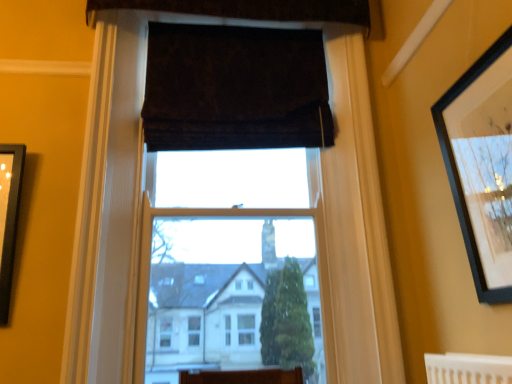
Question: Is the surface of black matte picture frame at upper right in direct contact with dark velvet curtain at upper center, the first curtain in the bottom-to-top sequence?

Choices:
 (A) no
 (B) yes

Answer: (A)

Question: Is black matte picture frame at upper right at the right side of dark velvet curtain at upper center, the first curtain in the bottom-to-top sequence?

Choices:
 (A) no
 (B) yes

Answer: (B)

Question: From the image's perspective, would you say black matte picture frame at upper right is positioned over dark velvet curtain at upper center, which ranks as the 2th curtain in top-to-bottom order?

Choices:
 (A) no
 (B) yes

Answer: (A)

Question: Is black matte picture frame at upper right bigger than dark velvet curtain at upper center, the first curtain in the bottom-to-top sequence?

Choices:
 (A) yes
 (B) no

Answer: (B)

Question: Is black matte picture frame at upper right thinner than dark velvet curtain at upper center, the first curtain in the bottom-to-top sequence?

Choices:
 (A) yes
 (B) no

Answer: (A)

Question: Based on their positions, is dark brown velvet curtain at upper center, which appears as the 1th curtain when viewed from the top, located to the left or right of dark velvet curtain at upper center, which ranks as the 2th curtain in top-to-bottom order?

Choices:
 (A) left
 (B) right

Answer: (A)

Question: Is dark brown velvet curtain at upper center, which appears as the 1th curtain when viewed from the top, wider or thinner than dark velvet curtain at upper center, the first curtain in the bottom-to-top sequence?

Choices:
 (A) wide
 (B) thin

Answer: (B)

Question: Is point (181, 6) closer or farther from the camera than point (183, 79)?

Choices:
 (A) farther
 (B) closer

Answer: (B)

Question: Is dark brown velvet curtain at upper center, which appears as the second curtain when ordered from the bottom, in front of or behind dark velvet curtain at upper center, which ranks as the 2th curtain in top-to-bottom order, in the image?

Choices:
 (A) behind
 (B) front

Answer: (A)

Question: Is black matte picture frame at upper right situated inside white wood window frame at center or outside?

Choices:
 (A) outside
 (B) inside

Answer: (A)

Question: Is point (499, 223) closer or farther from the camera than point (291, 352)?

Choices:
 (A) farther
 (B) closer

Answer: (B)

Question: In the image, is black matte picture frame at upper right on the left side or the right side of white wood window frame at center?

Choices:
 (A) left
 (B) right

Answer: (B)

Question: In terms of height, does black matte picture frame at upper right look taller or shorter compared to white wood window frame at center?

Choices:
 (A) tall
 (B) short

Answer: (B)

Question: Is dark velvet curtain at upper center, the first curtain in the bottom-to-top sequence, inside the boundaries of dark brown velvet curtain at upper center, which appears as the 1th curtain when viewed from the top, or outside?

Choices:
 (A) inside
 (B) outside

Answer: (B)

Question: From their relative heights in the image, would you say dark velvet curtain at upper center, which ranks as the 2th curtain in top-to-bottom order, is taller or shorter than dark brown velvet curtain at upper center, which appears as the second curtain when ordered from the bottom?

Choices:
 (A) short
 (B) tall

Answer: (B)